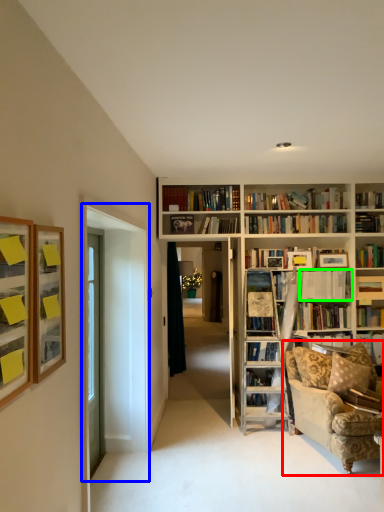
Question: Considering the real-world distances, which object is closest to studio couch (highlighted by a red box)? glass door (highlighted by a blue box) or book (highlighted by a green box).

Choices:
 (A) glass door
 (B) book

Answer: (B)